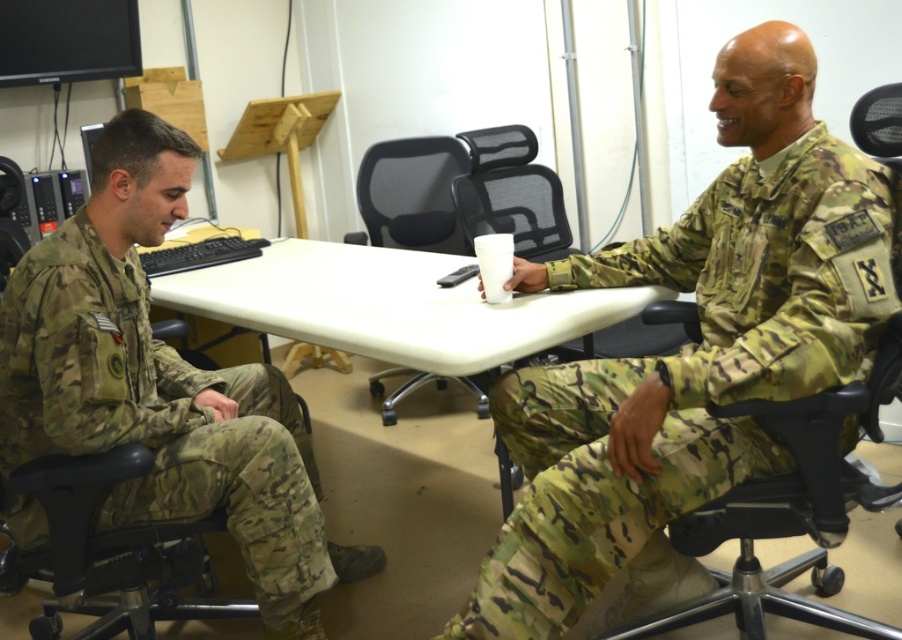
Consider the image. Does white plastic table at center have a larger size compared to black mesh chair at center?

Yes.

This screenshot has width=902, height=640. Describe the element at coordinates (390, 305) in the screenshot. I see `white plastic table at center` at that location.

Image resolution: width=902 pixels, height=640 pixels. I want to click on white plastic table at center, so click(390, 305).

Consider the image. Is camouflage uniform at left taller than black mesh chair at center?

Yes, camouflage uniform at left is taller than black mesh chair at center.

At what (x,y) coordinates should I click in order to perform the action: click on camouflage uniform at left. Please return your answer as a coordinate pair (x, y). Looking at the image, I should click on (161, 387).

Can you confirm if camo fabric uniform at right is taller than white plastic table at center?

Correct, camo fabric uniform at right is much taller as white plastic table at center.

Between camo fabric uniform at right and white plastic table at center, which one appears on the left side from the viewer's perspective?

From the viewer's perspective, white plastic table at center appears more on the left side.

Locate an element on the screen. The width and height of the screenshot is (902, 640). camo fabric uniform at right is located at coordinates (686, 378).